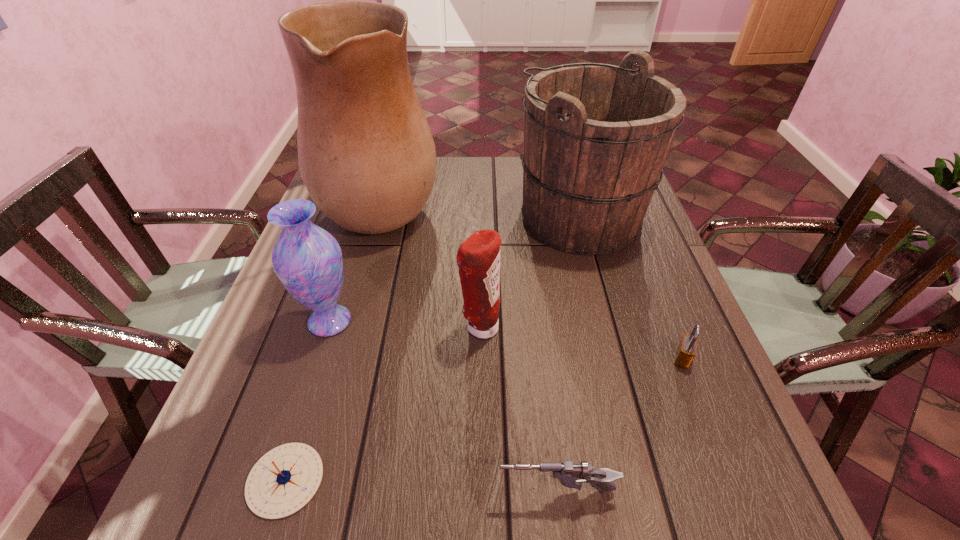
Where is `cream pitcher present at the left edge`? cream pitcher present at the left edge is located at coordinates (366, 154).

I want to click on vase situated at the left edge, so click(x=307, y=259).

At what (x,y) coordinates should I click in order to perform the action: click on compass that is at the left edge. Please return your answer as a coordinate pair (x, y). Looking at the image, I should click on (284, 480).

Locate an element on the screen. This screenshot has width=960, height=540. bucket situated at the right edge is located at coordinates (596, 136).

Locate an element on the screen. padlock that is positioned at the right edge is located at coordinates (686, 351).

I want to click on object that is positioned at the far left corner, so click(x=366, y=154).

This screenshot has height=540, width=960. In order to click on object that is at the near left corner in this screenshot , I will do `click(284, 480)`.

I want to click on object positioned at the far right corner, so click(596, 136).

You are a GUI agent. You are given a task and a screenshot of the screen. Output one action in this format:
    pyautogui.click(x=<x>, y=<y>)
    Task: Click on the vacant space at the far edge of the desktop
    
    Given the screenshot: What is the action you would take?
    pyautogui.click(x=456, y=170)

In the image, there is a desktop. Identify the location of vacant region at the left edge. This screenshot has width=960, height=540. (282, 423).